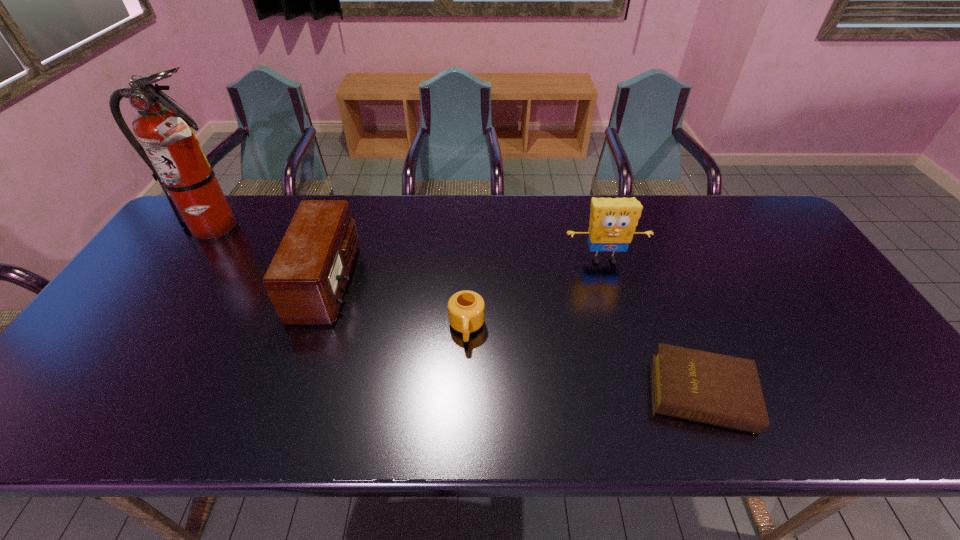
You are a GUI agent. You are given a task and a screenshot of the screen. Output one action in this format:
    pyautogui.click(x=<x>, y=<y>)
    Task: Click on the unoccupied position between the third object from left to right and the shortest object
    Image resolution: width=960 pixels, height=540 pixels.
    Given the screenshot: What is the action you would take?
    pyautogui.click(x=585, y=360)

The image size is (960, 540). Identify the location of the fourth closest object relative to the mug. (170, 148).

Locate which object is the third closest to the third object from left to right. Please provide its 2D coordinates. Your answer should be formatted as a tuple, i.e. [(x, y)], where the tuple contains the x and y coordinates of a point satisfying the conditions above.

[(721, 390)]

Image resolution: width=960 pixels, height=540 pixels. I want to click on free space in the image that satisfies the following two spatial constraints: 1. on the front-facing side of the radio receiver; 2. on the left side of the shortest object, so [290, 393].

Where is `free location that satisfies the following two spatial constraints: 1. on the face of the sponge; 2. on the right side of the shortest object`? The width and height of the screenshot is (960, 540). free location that satisfies the following two spatial constraints: 1. on the face of the sponge; 2. on the right side of the shortest object is located at coordinates (642, 393).

At what (x,y) coordinates should I click in order to perform the action: click on vacant area that satisfies the following two spatial constraints: 1. from the nozzle of the fire extinguisher; 2. on the right side of the Bible. Please return your answer as a coordinate pair (x, y). The image size is (960, 540). Looking at the image, I should click on (101, 393).

Find the location of a particular element. The width and height of the screenshot is (960, 540). free spot that satisfies the following two spatial constraints: 1. on the face of the sponge; 2. on the right side of the Bible is located at coordinates (642, 393).

Find the location of a particular element. Image resolution: width=960 pixels, height=540 pixels. vacant space that satisfies the following two spatial constraints: 1. on the face of the shortest object; 2. on the right side of the fourth shortest object is located at coordinates (642, 393).

This screenshot has width=960, height=540. I want to click on vacant area that satisfies the following two spatial constraints: 1. on the face of the sponge; 2. on the front-facing side of the second object from left to right, so click(x=610, y=281).

Identify the location of vacant area in the image that satisfies the following two spatial constraints: 1. on the handle side of the third object from left to right; 2. on the right side of the shortest object. Image resolution: width=960 pixels, height=540 pixels. (465, 393).